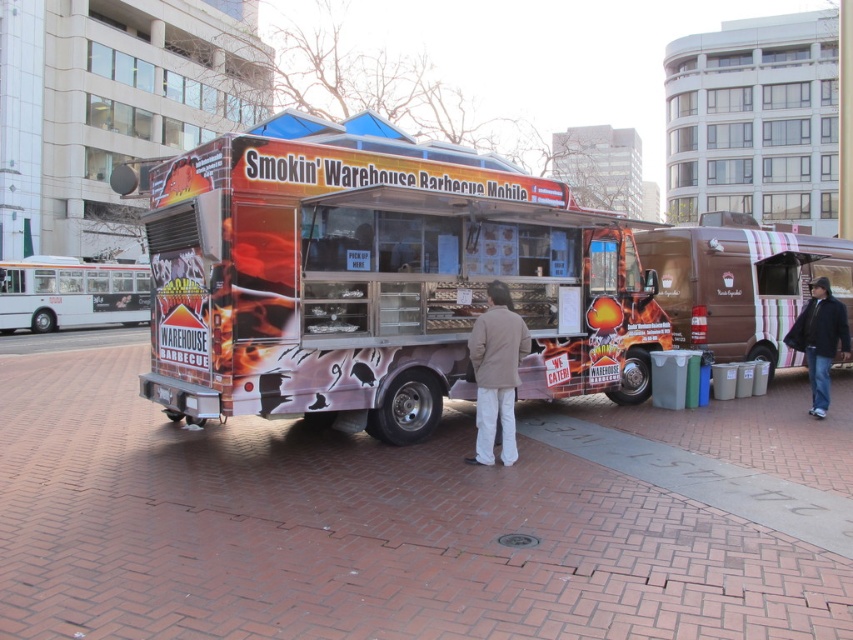
Does matte orange food truck at center appear on the right side of light beige jacket at center?

Incorrect, matte orange food truck at center is not on the right side of light beige jacket at center.

Where is `matte orange food truck at center`? This screenshot has height=640, width=853. matte orange food truck at center is located at coordinates (376, 285).

Is point (498, 176) positioned behind point (496, 300)?

Yes, point (498, 176) is farther from viewer.

Identify the location of matte orange food truck at center. The height and width of the screenshot is (640, 853). (376, 285).

Is light beige jacket at center shorter than dark blue jeans at lower right?

Correct, light beige jacket at center is not as tall as dark blue jeans at lower right.

Which is behind, point (503, 284) or point (795, 349)?

The point (795, 349) is more distant.

Find the location of `light beige jacket at center`. light beige jacket at center is located at coordinates (496, 372).

Does brick pavement at center have a greater height compared to matte orange food truck at center?

Yes.

You are a GUI agent. You are given a task and a screenshot of the screen. Output one action in this format:
    pyautogui.click(x=<x>, y=<y>)
    Task: Click on the brick pavement at center
    Image resolution: width=853 pixels, height=640 pixels.
    Given the screenshot: What is the action you would take?
    pyautogui.click(x=410, y=518)